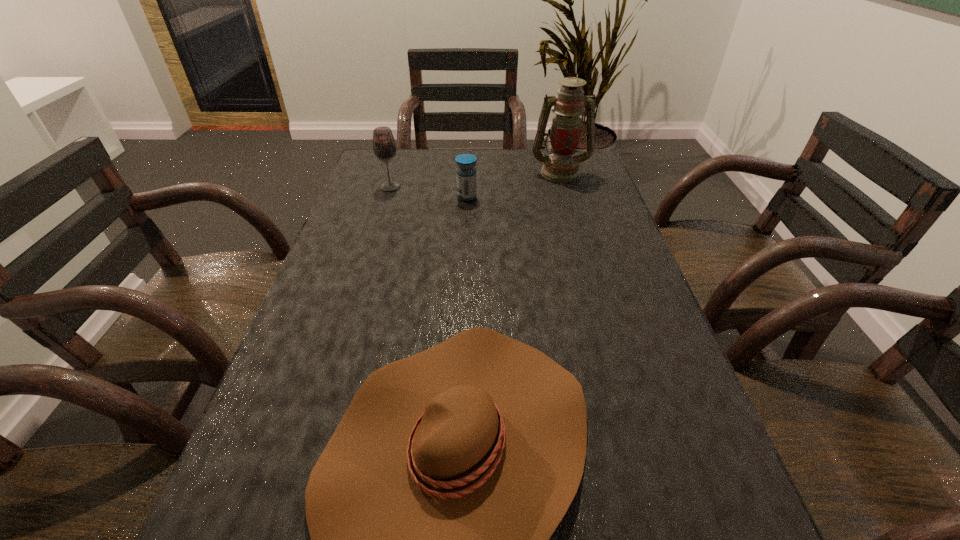
Where is `object that stands as the third closest to the oil lamp`? object that stands as the third closest to the oil lamp is located at coordinates (430, 510).

Image resolution: width=960 pixels, height=540 pixels. What are the coordinates of `free space in the image that satisfies the following two spatial constraints: 1. on the back side of the third tallest object; 2. on the left side of the tallest object` in the screenshot? It's located at (468, 172).